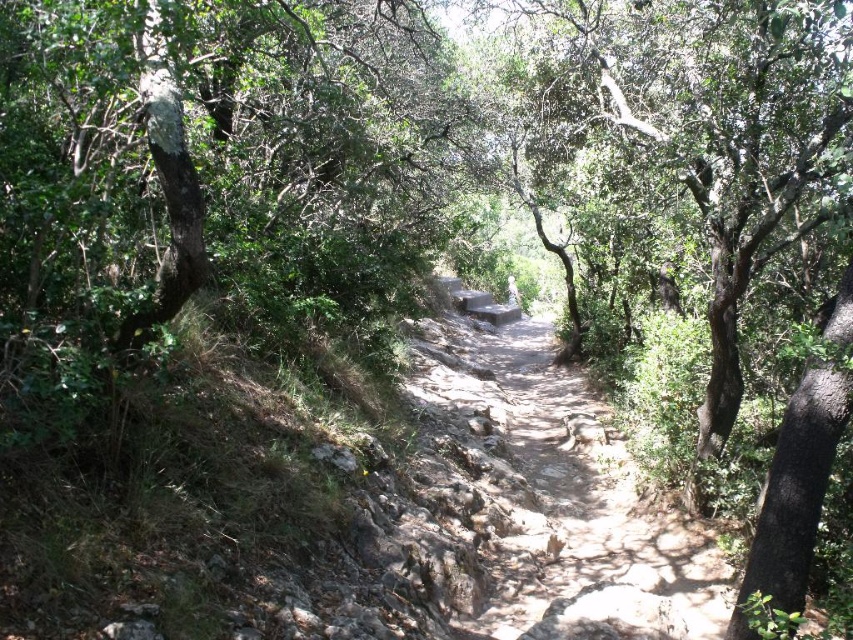
Question: Which point appears closest to the camera in this image?

Choices:
 (A) (666, 81)
 (B) (596, 404)

Answer: (A)

Question: Which point appears farthest from the camera in this image?

Choices:
 (A) (721, 16)
 (B) (486, 324)

Answer: (B)

Question: Does green leafy tree at center lie in front of dirt path at center?

Choices:
 (A) no
 (B) yes

Answer: (B)

Question: Which object appears farthest from the camera in this image?

Choices:
 (A) green leafy tree at center
 (B) dirt path at center

Answer: (B)

Question: Does green leafy tree at center lie behind dirt path at center?

Choices:
 (A) no
 (B) yes

Answer: (A)

Question: Can you confirm if green leafy tree at center is positioned to the left of dirt path at center?

Choices:
 (A) no
 (B) yes

Answer: (A)